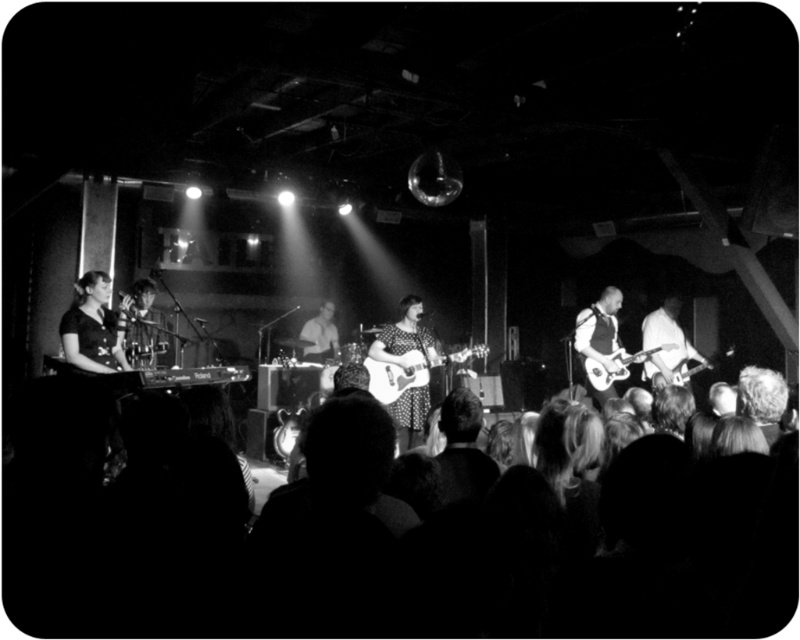
Is polka dot dress at center taller than metallic silver guitar at center?

Correct, polka dot dress at center is much taller as metallic silver guitar at center.

Does polka dot dress at center have a larger size compared to metallic silver guitar at center?

No.

Is point (396, 412) positioned after point (393, 387)?

Yes, it is behind point (393, 387).

Find the location of a particular element. polka dot dress at center is located at coordinates (405, 337).

Which of these two, silhouette crowd at lower center or shiny metallic guitar at right, stands taller?

With more height is silhouette crowd at lower center.

Can you confirm if silhouette crowd at lower center is positioned below shiny metallic guitar at right?

Yes, silhouette crowd at lower center is below shiny metallic guitar at right.

Describe the element at coordinates (354, 545) in the screenshot. I see `silhouette crowd at lower center` at that location.

This screenshot has width=800, height=640. I want to click on silhouette crowd at lower center, so click(x=354, y=545).

Between polka dot dress at center and shiny metallic guitar at right, which one has less height?

Standing shorter between the two is shiny metallic guitar at right.

Which is in front, point (405, 346) or point (602, 384)?

Positioned in front is point (405, 346).

Where is `polka dot dress at center`? The height and width of the screenshot is (640, 800). polka dot dress at center is located at coordinates (405, 337).